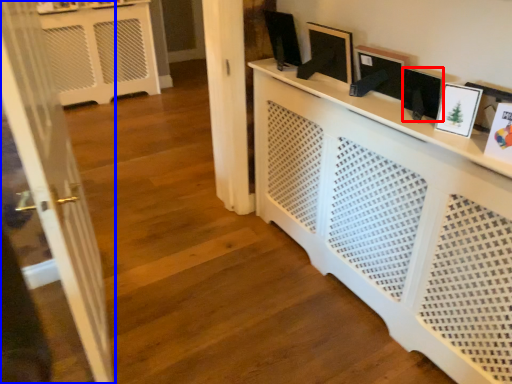
Question: Which object is closer to the camera taking this photo, picture frame (highlighted by a red box) or door (highlighted by a blue box)?

Choices:
 (A) picture frame
 (B) door

Answer: (B)